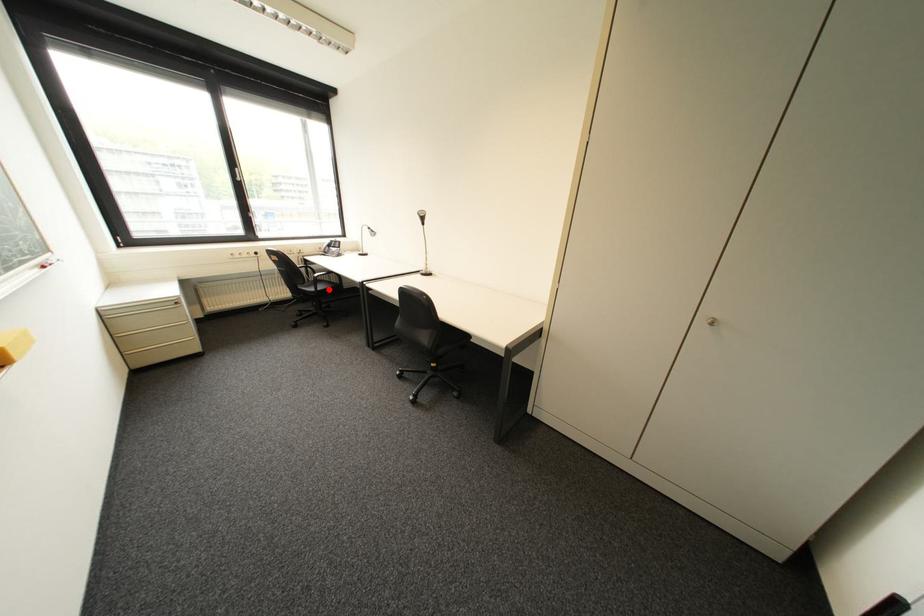
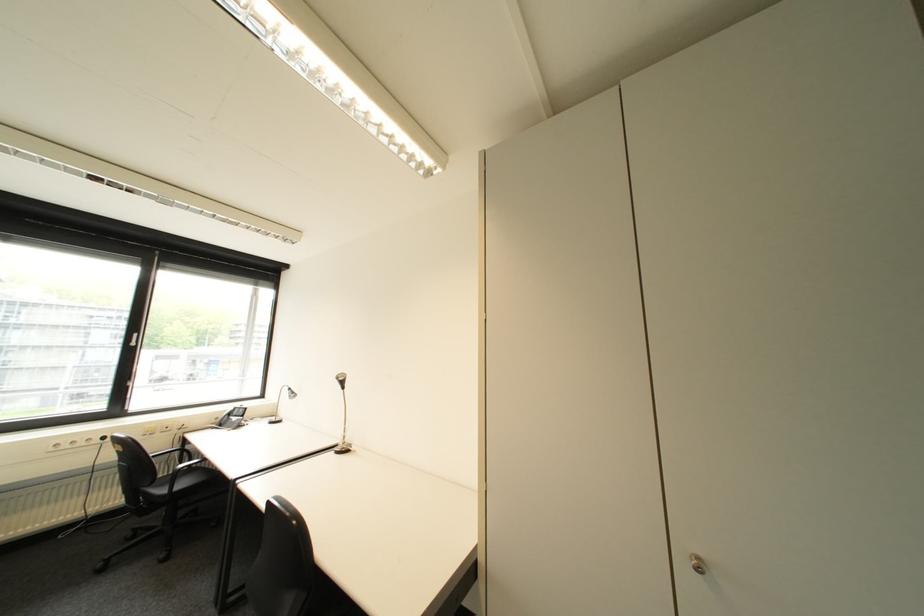
In the second image, find the point that corresponds to the highlighted location in the first image.

(187, 488)